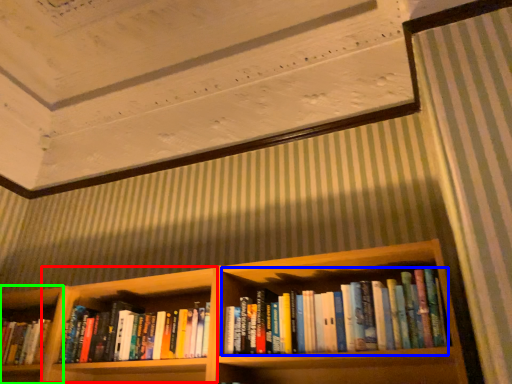
Question: Considering the real-world distances, which object is farthest from cabinet (highlighted by a red box)? book (highlighted by a blue box) or shelf (highlighted by a green box)?

Choices:
 (A) book
 (B) shelf

Answer: (A)